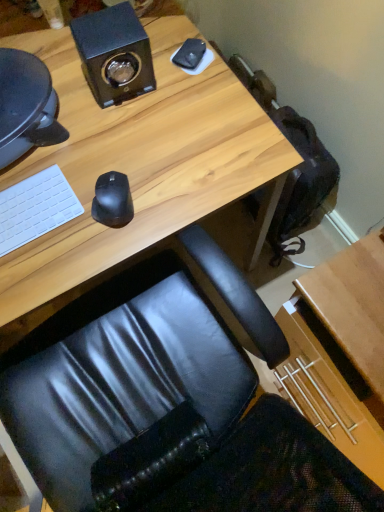
What are the coordinates of `vacant area that is in front of black matte speaker at upper left` in the screenshot? It's located at (127, 141).